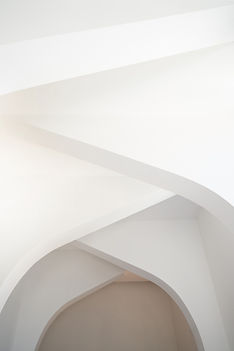
You are a GUI agent. You are given a task and a screenshot of the screen. Output one action in this format:
    pyautogui.click(x=<x>, y=<y>)
    Task: Click on the edge of lowest shelf
    
    Given the screenshot: What is the action you would take?
    pyautogui.click(x=73, y=301)